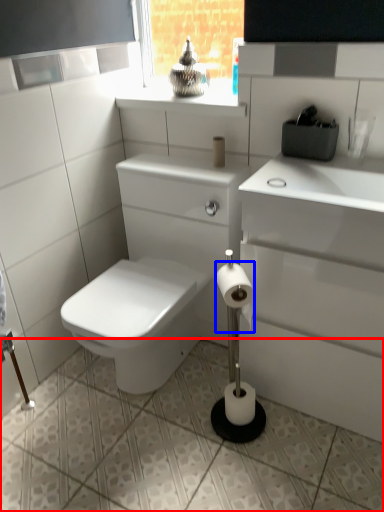
Question: Which of the following is the closest to the observer, ceramic tile (highlighted by a red box) or toilet paper (highlighted by a blue box)?

Choices:
 (A) ceramic tile
 (B) toilet paper

Answer: (A)